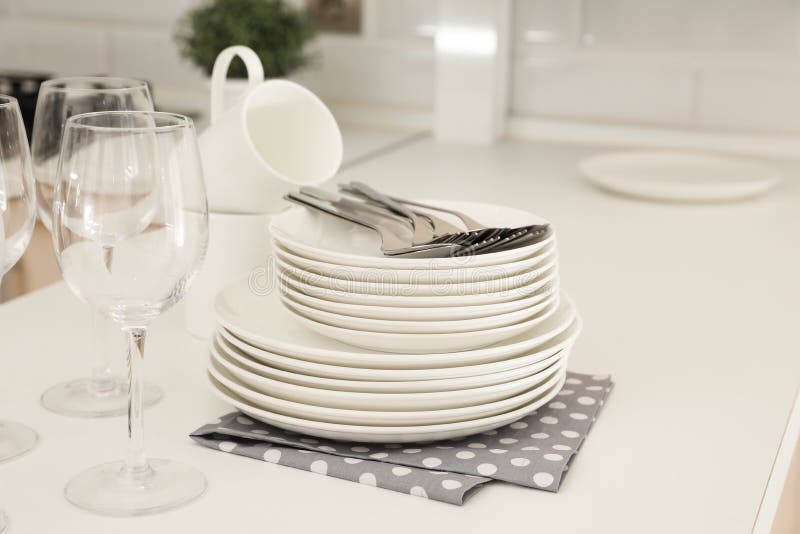
Where is `utensils`? The height and width of the screenshot is (534, 800). utensils is located at coordinates (398, 240), (441, 255), (472, 234), (493, 230), (530, 234), (517, 242).